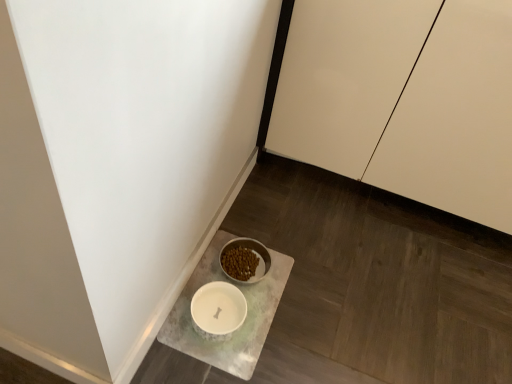
Question: From the image's perspective, is white marble tray at lower center above or below white matte cabinet at upper right?

Choices:
 (A) below
 (B) above

Answer: (A)

Question: Considering the positions of white marble tray at lower center and white matte cabinet at upper right in the image, is white marble tray at lower center wider or thinner than white matte cabinet at upper right?

Choices:
 (A) wide
 (B) thin

Answer: (B)

Question: Is white marble tray at lower center to the left or to the right of white matte cabinet at upper right in the image?

Choices:
 (A) right
 (B) left

Answer: (B)

Question: Would you say white matte cabinet at upper right is inside or outside white marble tray at lower center?

Choices:
 (A) inside
 (B) outside

Answer: (B)

Question: In terms of height, does white matte cabinet at upper right look taller or shorter compared to white marble tray at lower center?

Choices:
 (A) tall
 (B) short

Answer: (A)

Question: Is white matte cabinet at upper right wider or thinner than white marble tray at lower center?

Choices:
 (A) thin
 (B) wide

Answer: (B)

Question: Relative to white marble tray at lower center, is white matte cabinet at upper right in front or behind?

Choices:
 (A) front
 (B) behind

Answer: (A)